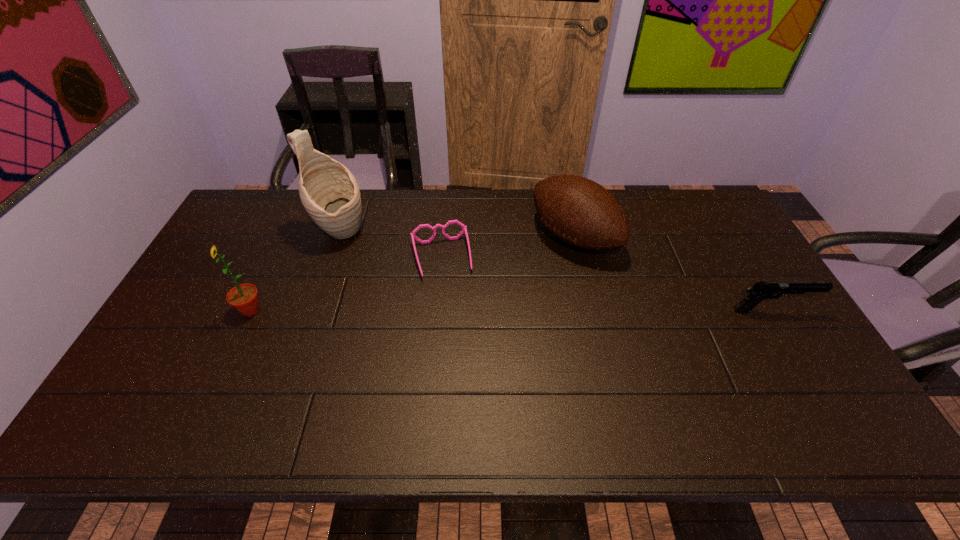
At what (x,y) coordinates should I click in order to perform the action: click on vacant space located 0.150m on the face of the leftmost object. Please return your answer as a coordinate pair (x, y). The width and height of the screenshot is (960, 540). Looking at the image, I should click on (182, 310).

The height and width of the screenshot is (540, 960). I want to click on free space located on the face of the leftmost object, so click(x=219, y=310).

Locate an element on the screen. This screenshot has height=540, width=960. free region located on the arms of the third object from left to right is located at coordinates pos(458,337).

Where is `vacant space situated 0.160m on the arms of the third object from left to right`? The image size is (960, 540). vacant space situated 0.160m on the arms of the third object from left to right is located at coordinates (455, 322).

The height and width of the screenshot is (540, 960). Identify the location of free space located on the arms of the third object from left to right. (455, 322).

This screenshot has width=960, height=540. What are the coordinates of `free space located on the laces of the football` in the screenshot? It's located at (513, 281).

This screenshot has height=540, width=960. I want to click on free space located 0.070m on the laces of the football, so click(x=532, y=268).

Image resolution: width=960 pixels, height=540 pixels. Identify the location of free space located on the laces of the football. (493, 294).

You are a GUI agent. You are given a task and a screenshot of the screen. Output one action in this format:
    pyautogui.click(x=<x>, y=<y>)
    Task: Click on the free space located 0.180m at the spout of the pitcher
    
    Given the screenshot: What is the action you would take?
    pyautogui.click(x=399, y=267)

This screenshot has width=960, height=540. In order to click on free point located 0.290m at the spout of the pitcher in this screenshot , I will do `click(426, 283)`.